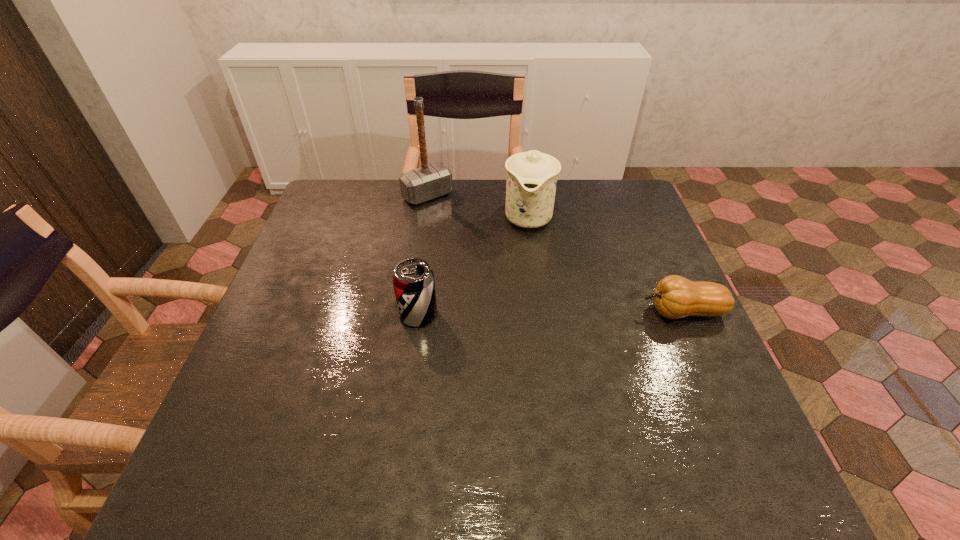
Identify the location of blank area located 0.180m on the spout of the chinaware. This screenshot has height=540, width=960. (521, 284).

The image size is (960, 540). I want to click on free spot located 0.270m on the spout of the chinaware, so click(518, 310).

Identify the location of free region located on the spout of the chinaware. Image resolution: width=960 pixels, height=540 pixels. (518, 310).

The image size is (960, 540). What are the coordinates of `free space located on the striking surface of the hammer` in the screenshot? It's located at (485, 252).

At what (x,y) coordinates should I click in order to perform the action: click on vacant region located 0.170m on the striking surface of the hammer. Please return your answer as a coordinate pair (x, y). Looking at the image, I should click on (468, 235).

Find the location of a particular element. The width and height of the screenshot is (960, 540). free space located 0.290m on the striking surface of the hammer is located at coordinates (491, 258).

Identify the location of chinaware located in the far edge section of the desktop. The image size is (960, 540). (532, 176).

Locate an element on the screen. hammer that is at the far edge is located at coordinates (428, 182).

The width and height of the screenshot is (960, 540). What are the coordinates of `object that is positioned at the right edge` in the screenshot? It's located at (675, 297).

Where is `free space at the far edge`? This screenshot has width=960, height=540. free space at the far edge is located at coordinates (x=585, y=207).